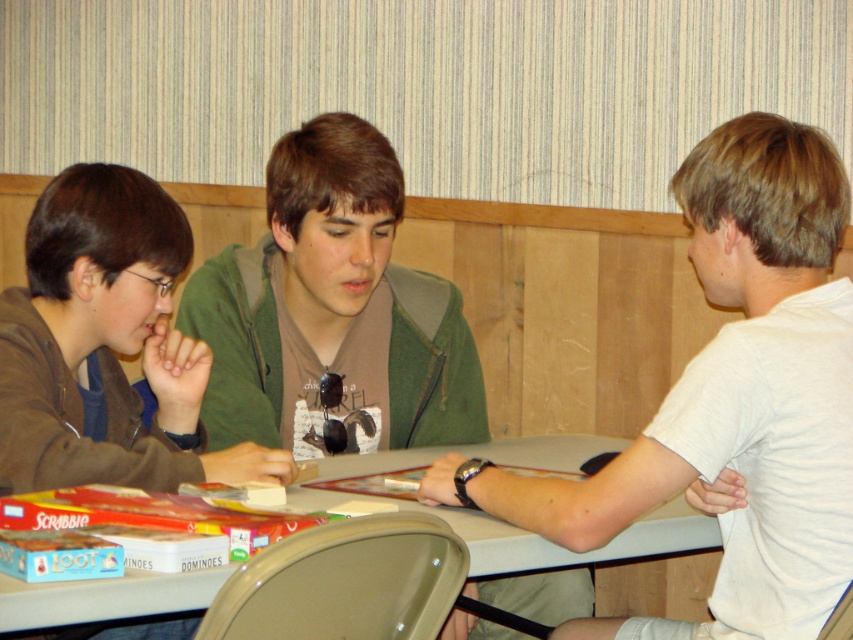
Is white cotton shirt at right to the left of smooth plastic table at center from the viewer's perspective?

In fact, white cotton shirt at right is to the right of smooth plastic table at center.

Is white cotton shirt at right positioned in front of smooth plastic table at center?

Yes, it is in front of smooth plastic table at center.

Which is behind, point (567, 506) or point (171, 593)?

Positioned behind is point (567, 506).

This screenshot has width=853, height=640. I want to click on white cotton shirt at right, so click(732, 401).

Is the position of green matte jacket at center more distant than that of smooth plastic table at center?

Yes, it is behind smooth plastic table at center.

Can you confirm if green matte jacket at center is positioned below smooth plastic table at center?

No.

This screenshot has height=640, width=853. What do you see at coordinates (332, 307) in the screenshot?
I see `green matte jacket at center` at bounding box center [332, 307].

Locate an element on the screen. green matte jacket at center is located at coordinates (332, 307).

Who is more distant from viewer, (762, 225) or (219, 316)?

The point (219, 316) is more distant.

Is white cotton shirt at right below green matte jacket at center?

Yes.

This screenshot has height=640, width=853. What do you see at coordinates (732, 401) in the screenshot?
I see `white cotton shirt at right` at bounding box center [732, 401].

The width and height of the screenshot is (853, 640). Find the location of `white cotton shirt at right`. white cotton shirt at right is located at coordinates (732, 401).